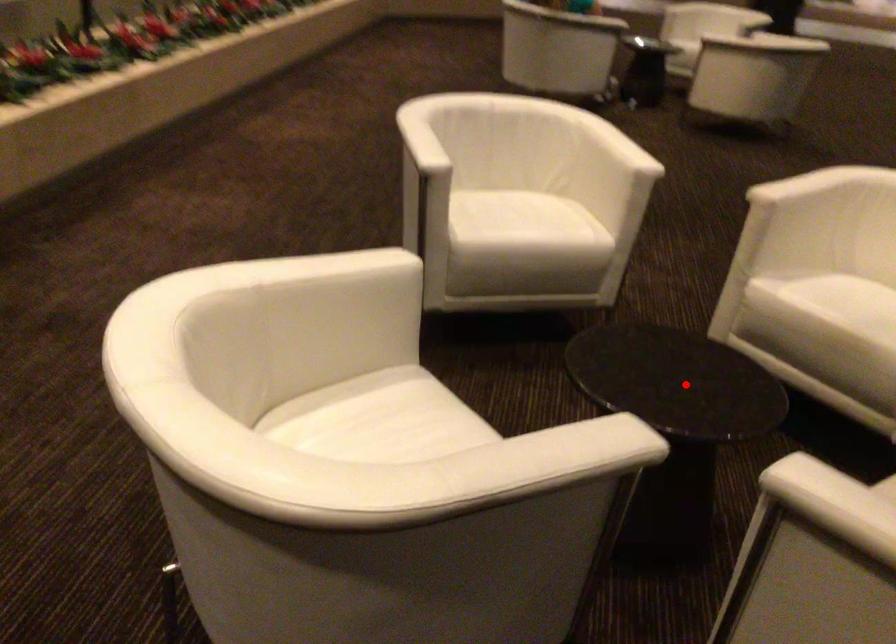
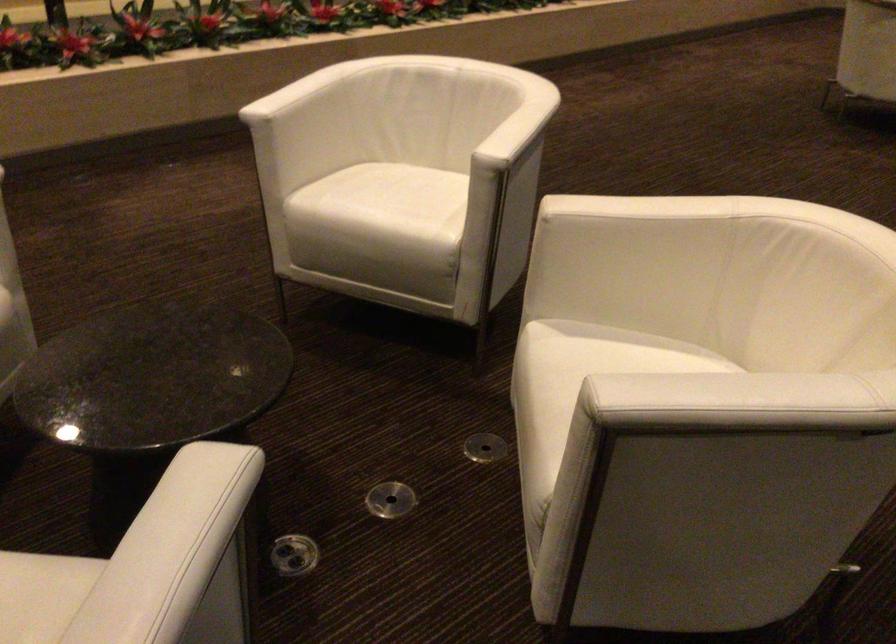
Locate, in the second image, the point that corresponds to the highlighted location in the first image.

(152, 377)